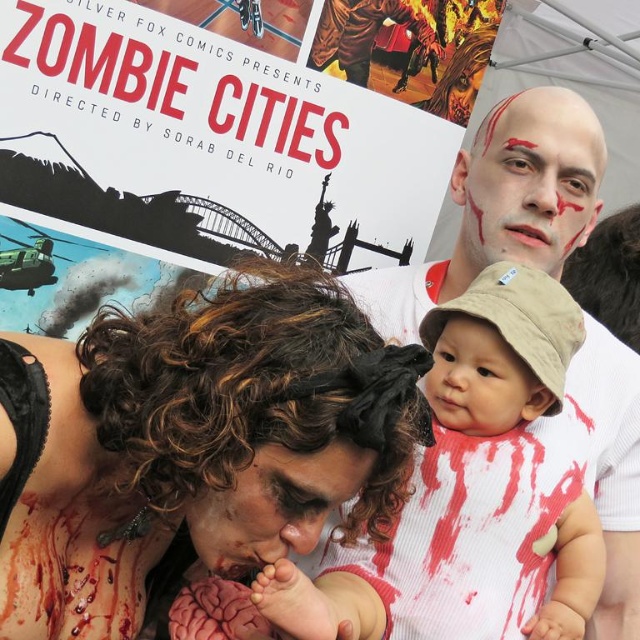
Is white ribbed onesie at center shorter than pale matte face at upper center?

No.

Can you confirm if white ribbed onesie at center is positioned below pale matte face at upper center?

Indeed, white ribbed onesie at center is positioned under pale matte face at upper center.

Is point (440, 364) positioned behind point (541, 125)?

No, (440, 364) is closer to viewer.

Where is `white ribbed onesie at center`? white ribbed onesie at center is located at coordinates (474, 490).

Does point (442, 524) come closer to viewer compared to point (333, 451)?

No.

In the scene shown: Does white ribbed onesie at center appear under matte black face at center?

Indeed, white ribbed onesie at center is positioned under matte black face at center.

Is point (433, 596) in front of point (276, 508)?

No, it is behind (276, 508).

The width and height of the screenshot is (640, 640). I want to click on white ribbed onesie at center, so [x=474, y=490].

Who is lower down, curly hair at center or matte black face at center?

matte black face at center is lower down.

What do you see at coordinates (193, 444) in the screenshot? I see `curly hair at center` at bounding box center [193, 444].

Identify the location of curly hair at center. The image size is (640, 640). (193, 444).